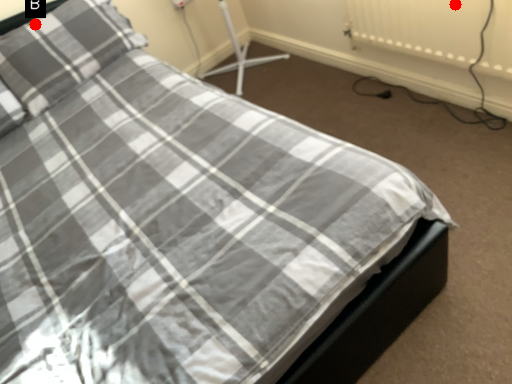
Question: Two points are circled on the image, labeled by A and B beside each circle. Which point is closer to the camera taking this photo?

Choices:
 (A) A is closer
 (B) B is closer

Answer: (A)